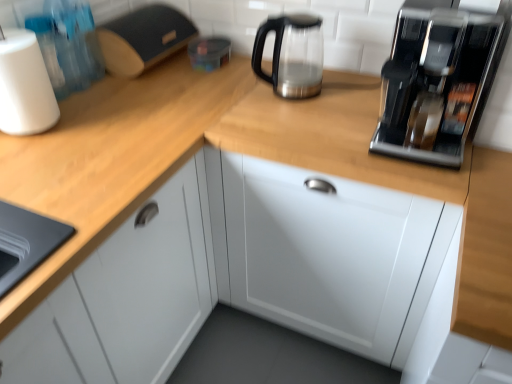
Question: Is white matte paper towel at left wider or thinner than wooden at left?

Choices:
 (A) thin
 (B) wide

Answer: (A)

Question: Considering the positions of white matte paper towel at left and wooden at left in the image, is white matte paper towel at left bigger or smaller than wooden at left?

Choices:
 (A) small
 (B) big

Answer: (A)

Question: Based on their relative distances, which object is farther from the white matte paper towel at left?

Choices:
 (A) wooden at left
 (B) matte black bread bin at upper left
 (C) satin metallic kettle at upper center
 (D) white glossy cabinet at center
 (E) sleek metallic coffee machine at upper right

Answer: (E)

Question: Based on their relative distances, which object is farther from the white glossy cabinet at center?

Choices:
 (A) satin metallic kettle at upper center
 (B) wooden at left
 (C) sleek metallic coffee machine at upper right
 (D) white matte paper towel at left
 (E) matte black bread bin at upper left

Answer: (D)